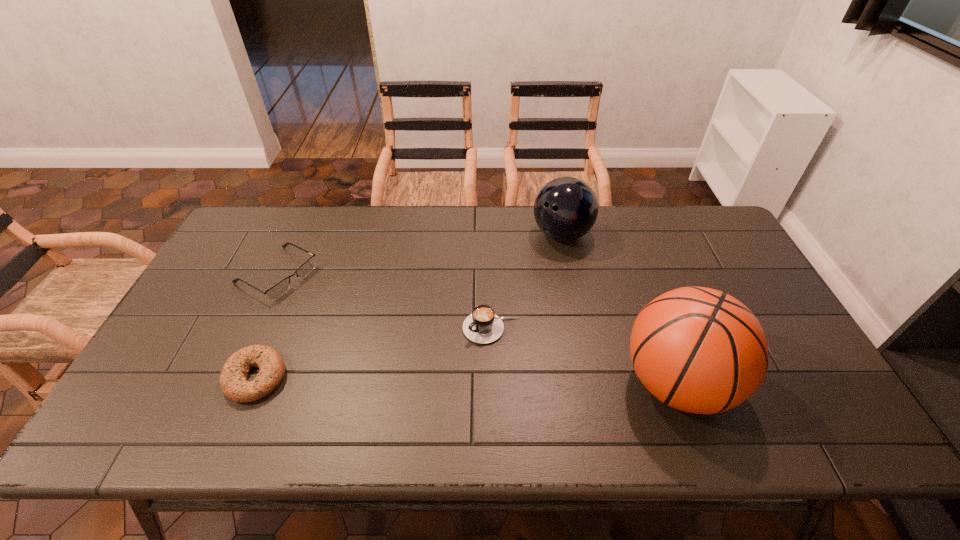
Find the location of a particular element. The width and height of the screenshot is (960, 540). basketball situated at the near edge is located at coordinates (699, 350).

Identify the location of object present at the left edge. (279, 289).

Locate an element on the screen. This screenshot has height=540, width=960. object that is at the far left corner is located at coordinates (279, 289).

Where is `vacant region at the far edge of the desktop`? This screenshot has width=960, height=540. vacant region at the far edge of the desktop is located at coordinates (344, 228).

I want to click on blank space at the near edge of the desktop, so click(x=602, y=375).

Where is `free space at the left edge of the desktop`? free space at the left edge of the desktop is located at coordinates (254, 278).

In the image, there is a desktop. Identify the location of vacant space at the right edge. The width and height of the screenshot is (960, 540). (755, 286).

Find the location of a particular element. vacant space at the far left corner of the desktop is located at coordinates (260, 218).

Identify the location of blank space at the far right corner. The width and height of the screenshot is (960, 540). (700, 226).

Where is `unoccupied position between the bowling ball and the tallest object`? unoccupied position between the bowling ball and the tallest object is located at coordinates (618, 309).